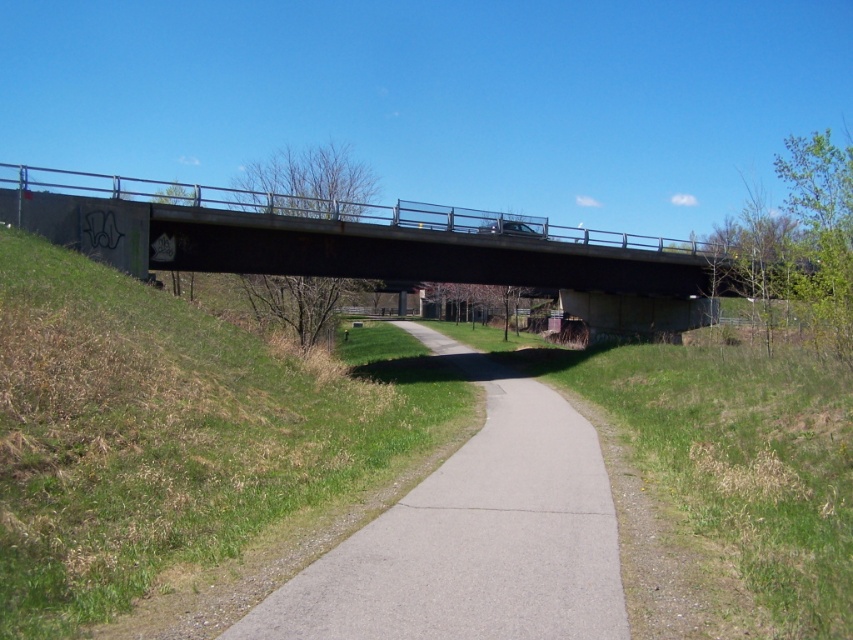
You are standing at the point labeled as point (474,536) on the gray asphalt path at center. Looking towards the bridge, which direction should you walk to reach the bridge first?

The point (474,536) corresponds to the gray asphalt path at center, so walking straight ahead towards the bridge will lead you directly to it.

You are standing at the starting point of the gray asphalt path at center. If you walk straight ahead, will you eventually reach the bridge mentioned in the scene description?

Yes, because the scene describes the paved pathway leading towards the bridge, so walking straight on the gray asphalt path at center will lead you to the bridge.